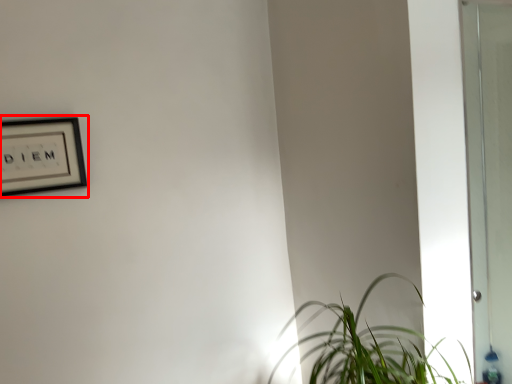
Question: From the image's perspective, what is the correct spatial relationship of picture frame (annotated by the red box) in relation to houseplant?

Choices:
 (A) below
 (B) above

Answer: (B)